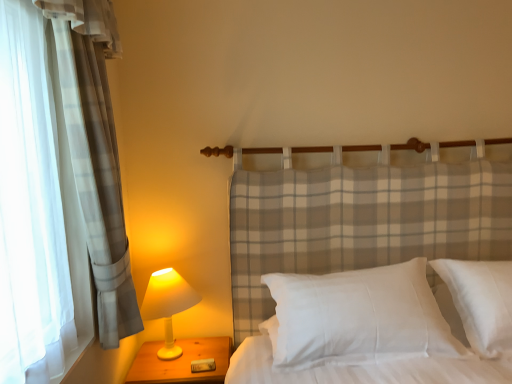
This screenshot has width=512, height=384. What do you see at coordinates (481, 301) in the screenshot?
I see `white satin pillow at center` at bounding box center [481, 301].

This screenshot has width=512, height=384. What do you see at coordinates (360, 333) in the screenshot?
I see `white cotton pillow at center` at bounding box center [360, 333].

Locate an element on the screen. The width and height of the screenshot is (512, 384). wooden nightstand at lower left is located at coordinates (181, 362).

This screenshot has width=512, height=384. What do you see at coordinates (181, 362) in the screenshot?
I see `wooden nightstand at lower left` at bounding box center [181, 362].

Locate an element on the screen. white matte lamp at left is located at coordinates (167, 305).

From the image's perspective, does wooden nightstand at lower left appear higher than white satin pillow at center?

No, from the image's perspective, wooden nightstand at lower left is not above white satin pillow at center.

Does point (205, 374) lie behind point (492, 284)?

Yes, it is.

Is white satin pillow at center inside wooden nightstand at lower left?

That's incorrect, white satin pillow at center is not inside wooden nightstand at lower left.

Who is bigger, wooden nightstand at lower left or white satin pillow at center?

white satin pillow at center.

Locate an element on the screen. nightstand that appears on the left of white cotton pillow at center is located at coordinates (181, 362).

Measure the distance between wooden nightstand at lower left and white cotton pillow at center.

wooden nightstand at lower left is 24.09 inches from white cotton pillow at center.

Which point is more forward, (183, 372) or (397, 306)?

Point (397, 306)

In terms of height, does wooden nightstand at lower left look taller or shorter compared to white cotton pillow at center?

Considering their sizes, wooden nightstand at lower left has less height than white cotton pillow at center.

Does white cotton pillow at center touch white satin pillow at center?

white cotton pillow at center is not next to white satin pillow at center, and they're not touching.

What's the angular difference between white cotton pillow at center and white satin pillow at center's facing directions?

The facing directions of white cotton pillow at center and white satin pillow at center are 0.000155 degrees apart.

Looking at the image, does white cotton pillow at center seem bigger or smaller compared to white satin pillow at center?

Clearly, white cotton pillow at center is larger in size than white satin pillow at center.

Between white cotton pillow at center and white satin pillow at center, which one has less height?

With less height is white cotton pillow at center.

Is white matte lamp at left beside white cotton pillow at center?

There is a gap between white matte lamp at left and white cotton pillow at center.

From the image's perspective, which object appears higher, white matte lamp at left or white cotton pillow at center?

From the image's view, white cotton pillow at center is above.

Looking at this image, is white matte lamp at left aimed at white cotton pillow at center?

No.

Does white matte lamp at left have a lesser width compared to white cotton pillow at center?

Indeed, white matte lamp at left has a lesser width compared to white cotton pillow at center.

Is white satin pillow at center surrounding wooden nightstand at lower left?

No, wooden nightstand at lower left is not inside white satin pillow at center.

Considering the sizes of white satin pillow at center and wooden nightstand at lower left in the image, is white satin pillow at center taller or shorter than wooden nightstand at lower left?

Considering their sizes, white satin pillow at center has more height than wooden nightstand at lower left.

Is white satin pillow at center wider than wooden nightstand at lower left?

No, white satin pillow at center is not wider than wooden nightstand at lower left.

This screenshot has height=384, width=512. In order to click on nightstand that is on the left side of white satin pillow at center in this screenshot , I will do pos(181,362).

Looking at this image, who is shorter, white satin pillow at center or white matte lamp at left?

white satin pillow at center.

Considering the sizes of objects white satin pillow at center and white matte lamp at left in the image provided, who is bigger, white satin pillow at center or white matte lamp at left?

With larger size is white satin pillow at center.

Consider the image. From the image's perspective, which one is positioned lower, white satin pillow at center or white matte lamp at left?

white matte lamp at left is shown below in the image.

Can you confirm if white satin pillow at center is thinner than white matte lamp at left?

Incorrect, the width of white satin pillow at center is not less than that of white matte lamp at left.

Which of these two, white satin pillow at center or white cotton pillow at center, stands taller?

With more height is white satin pillow at center.

Image resolution: width=512 pixels, height=384 pixels. In the image, there is a white cotton pillow at center. In order to click on pillow below it (from a real-world perspective) in this screenshot , I will do `click(481, 301)`.

Considering the sizes of white satin pillow at center and white cotton pillow at center in the image, is white satin pillow at center wider or thinner than white cotton pillow at center?

In the image, white satin pillow at center appears to be more narrow than white cotton pillow at center.

Find the location of a particular element. Image resolution: width=512 pixels, height=384 pixels. nightstand that appears below the white satin pillow at center (from the image's perspective) is located at coordinates (181, 362).

Where is `nightstand behind the white cotton pillow at center`? This screenshot has width=512, height=384. nightstand behind the white cotton pillow at center is located at coordinates (181, 362).

Looking at the image, which one is located further to white cotton pillow at center, white matte lamp at left or white satin pillow at center?

Based on the image, white matte lamp at left appears to be further to white cotton pillow at center.

When comparing their distances from white matte lamp at left, does white satin pillow at center or white cotton pillow at center seem further?

white satin pillow at center is further to white matte lamp at left.

Considering their positions, is white matte lamp at left positioned further to wooden nightstand at lower left than white cotton pillow at center?

white cotton pillow at center.

Estimate the real-world distances between objects in this image. Which object is further from white satin pillow at center, wooden nightstand at lower left or white matte lamp at left?

The object further to white satin pillow at center is white matte lamp at left.

Based on their spatial positions, is white satin pillow at center or wooden nightstand at lower left closer to white cotton pillow at center?

The object closer to white cotton pillow at center is white satin pillow at center.

Which object lies further to the anchor point white matte lamp at left, wooden nightstand at lower left or white cotton pillow at center?

white cotton pillow at center is further to white matte lamp at left.

When comparing their distances from white satin pillow at center, does wooden nightstand at lower left or white cotton pillow at center seem closer?

Based on the image, white cotton pillow at center appears to be nearer to white satin pillow at center.

Estimate the real-world distances between objects in this image. Which object is closer to wooden nightstand at lower left, white cotton pillow at center or white matte lamp at left?

The object closer to wooden nightstand at lower left is white matte lamp at left.

At what (x,y) coordinates should I click in order to perform the action: click on nightstand located between white matte lamp at left and white satin pillow at center in the left-right direction. Please return your answer as a coordinate pair (x, y). This screenshot has width=512, height=384. Looking at the image, I should click on tap(181, 362).

Identify the location of bed between wooden nightstand at lower left and white satin pillow at center. (360, 333).

The image size is (512, 384). Find the location of `nightstand between white matte lamp at left and white cotton pillow at center from left to right`. nightstand between white matte lamp at left and white cotton pillow at center from left to right is located at coordinates [181, 362].

Image resolution: width=512 pixels, height=384 pixels. What are the coordinates of `bed situated between white matte lamp at left and white satin pillow at center from left to right` in the screenshot? It's located at (360, 333).